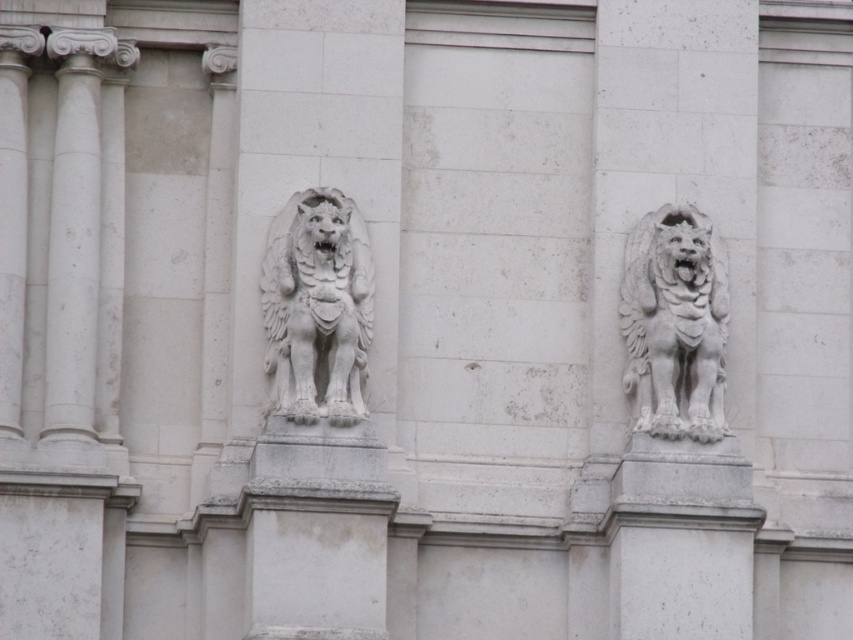
Question: Can you confirm if white stone lion at center is positioned below white stone lion at right?

Choices:
 (A) yes
 (B) no

Answer: (B)

Question: Which point is closer to the camera taking this photo?

Choices:
 (A) (289, 416)
 (B) (659, 360)

Answer: (A)

Question: Which point is closer to the camera?

Choices:
 (A) white stone lion at center
 (B) white stone lion at right

Answer: (A)

Question: Among these points, which one is farthest from the camera?

Choices:
 (A) (329, 358)
 (B) (666, 257)

Answer: (B)

Question: Can you confirm if white stone lion at center is thinner than white stone lion at right?

Choices:
 (A) no
 (B) yes

Answer: (A)

Question: From the image, what is the correct spatial relationship of white stone lion at center in relation to white stone lion at right?

Choices:
 (A) right
 (B) left

Answer: (B)